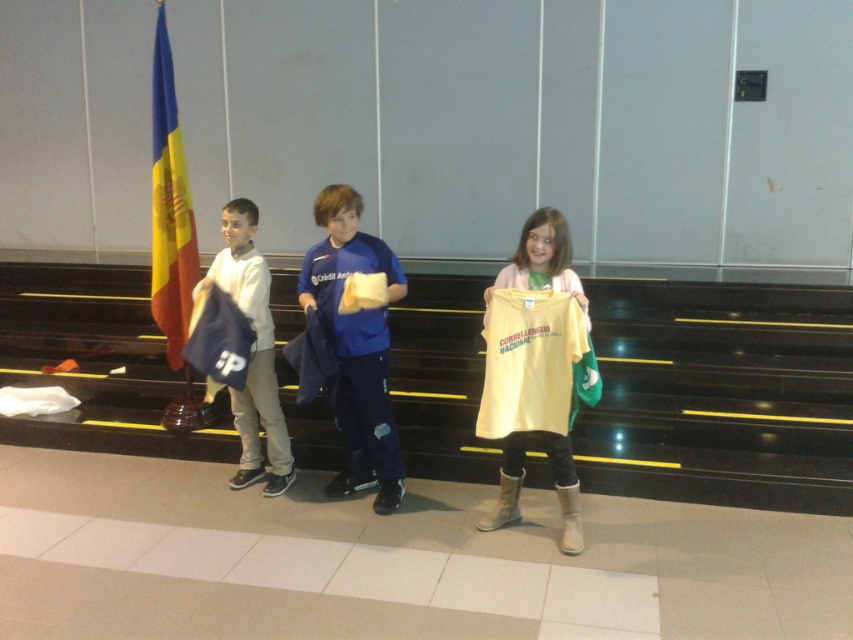
What is located at the coordinates point (357,346)?

The blue fabric jacket at center is located at point (357,346).

You are a stagehand in a theater and need to place a 1.5 meter long ladder between the blue fabric jacket at center and the blue and yellow fabric flag at left. Will the ladder fit between them?

The blue fabric jacket at center is 1.23 meters away from the blue and yellow fabric flag at left. Since the ladder is 1.5 meters long, it is longer than the distance between them, so the ladder will not fit between the blue fabric jacket at center and the blue and yellow fabric flag at left.